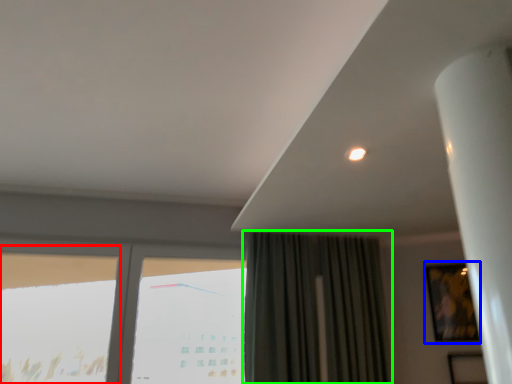
Question: Which object is the closest to the window (highlighted by a red box)? Choose among these: picture frame (highlighted by a blue box) or curtain (highlighted by a green box).

Choices:
 (A) picture frame
 (B) curtain

Answer: (B)